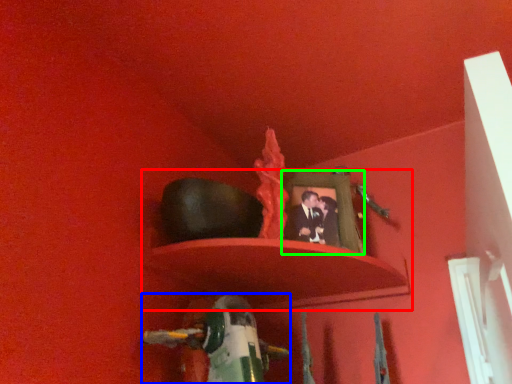
Question: Considering the real-world distances, which object is closest to shelf (highlighted by a red box)? toy (highlighted by a blue box) or picture frame (highlighted by a green box).

Choices:
 (A) toy
 (B) picture frame

Answer: (B)